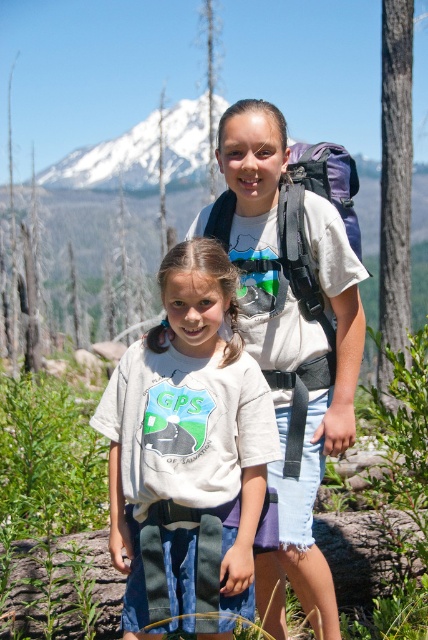
Between white cotton shirt at center and snowy peak at upper center, which one appears on the left side from the viewer's perspective?

snowy peak at upper center

Is point (154, 508) farther from camera compared to point (65, 164)?

No, (154, 508) is in front of (65, 164).

Locate an element on the screen. white cotton shirt at center is located at coordinates (187, 452).

Which is behind, point (284, 368) or point (184, 113)?

Positioned behind is point (184, 113).

Does white matte backpack at center appear over snowy peak at upper center?

No, white matte backpack at center is not above snowy peak at upper center.

Does point (282, 429) come behind point (71, 186)?

No, (282, 429) is in front of (71, 186).

Find the location of a particular element. This screenshot has height=640, width=428. white matte backpack at center is located at coordinates (291, 337).

Does white cotton shirt at center have a smaller size compared to white matte backpack at center?

Yes.

Can you confirm if white cotton shirt at center is bigger than white matte backpack at center?

Incorrect, white cotton shirt at center is not larger than white matte backpack at center.

I want to click on white cotton shirt at center, so (x=187, y=452).